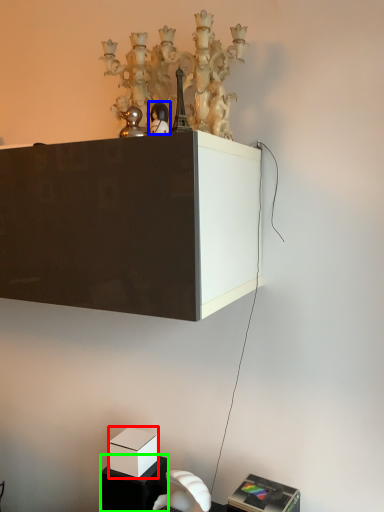
Question: Considering the real-world distances, which object is farthest from box (highlighted by a red box)? toy (highlighted by a blue box) or furniture (highlighted by a green box)?

Choices:
 (A) toy
 (B) furniture

Answer: (A)